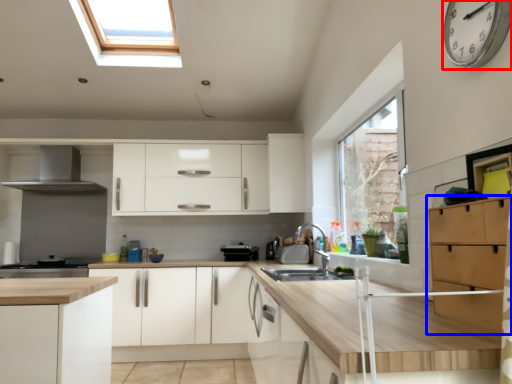
Question: Which object is further to the camera taking this photo, clock (highlighted by a red box) or cabinetry (highlighted by a blue box)?

Choices:
 (A) clock
 (B) cabinetry

Answer: (A)